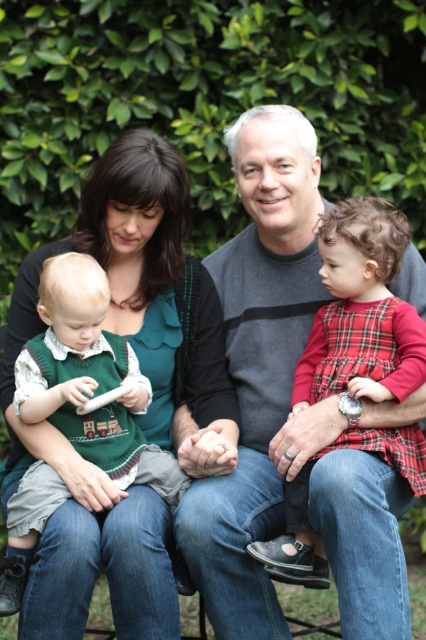
Question: Can you confirm if plaid fabric dress at center is positioned to the left of green knitted vest at left?

Choices:
 (A) yes
 (B) no

Answer: (B)

Question: Based on their relative distances, which object is nearer to the plaid fabric dress at center?

Choices:
 (A) green knitted vest at left
 (B) green matte dress at center

Answer: (B)

Question: Is green matte dress at center above green knitted vest at left?

Choices:
 (A) no
 (B) yes

Answer: (B)

Question: Is plaid fabric dress at center closer to camera compared to green knitted vest at left?

Choices:
 (A) no
 (B) yes

Answer: (A)

Question: Which object appears farthest from the camera in this image?

Choices:
 (A) green matte dress at center
 (B) plaid fabric dress at center

Answer: (B)

Question: Which point is farther to the camera?

Choices:
 (A) (43, 572)
 (B) (57, 298)
 (C) (357, 387)

Answer: (C)